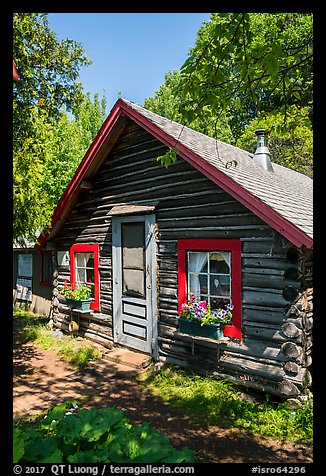
Where is `red border around window`? red border around window is located at coordinates pos(188,245), pos(93,247).